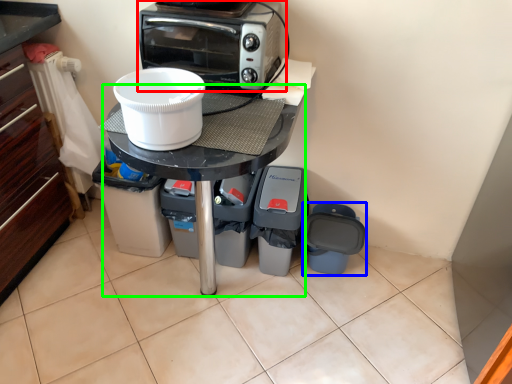
Question: Estimate the real-world distances between objects in this image. Which object is farther from kitchen appliance (highlighted by a red box), appliance (highlighted by a blue box) or table (highlighted by a green box)?

Choices:
 (A) appliance
 (B) table

Answer: (A)